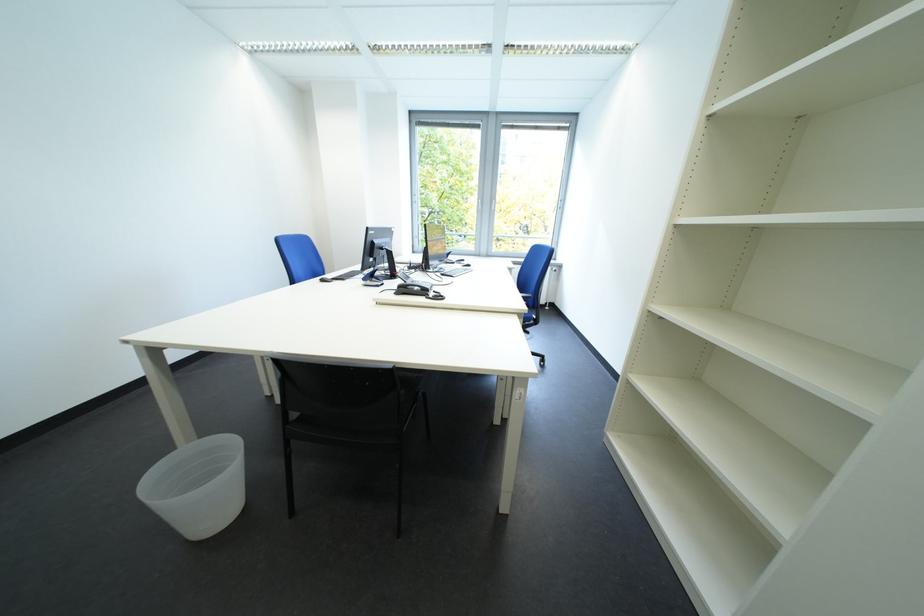
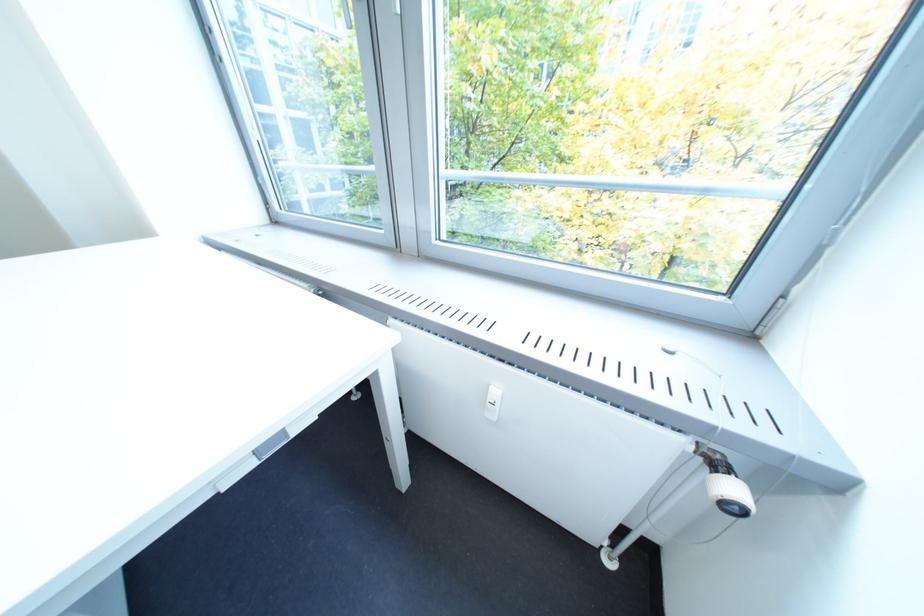
In the second image, find the point that corresponds to pixel 567 273 in the first image.

(746, 512)